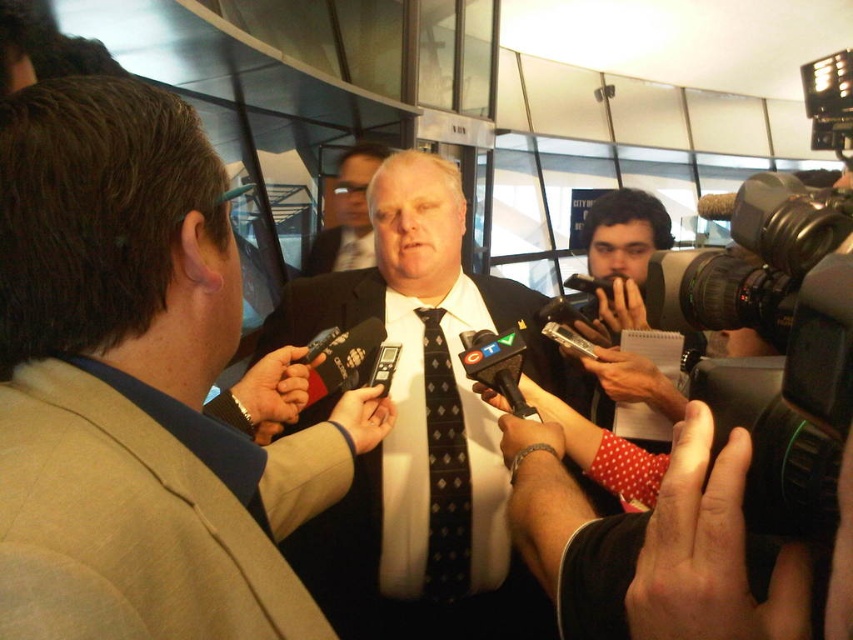
Does dark blue textured suit at center have a smaller size compared to matte black tie at center?

Yes.

Measure the distance from dark blue textured suit at center to matte black tie at center.

dark blue textured suit at center and matte black tie at center are 7.82 feet apart.

This screenshot has width=853, height=640. What are the coordinates of `dark blue textured suit at center` in the screenshot? It's located at (422, 472).

Between light brown suit at center and black dotted tie at center, which one is positioned higher?

light brown suit at center is above.

Does point (300, 512) lie in front of point (454, 538)?

That is True.

I want to click on light brown suit at center, so click(135, 387).

Does light brown suit at center appear over matte black tie at center?

No, light brown suit at center is not above matte black tie at center.

Does point (18, 536) come closer to viewer compared to point (364, 157)?

Yes, point (18, 536) is in front of point (364, 157).

You are a GUI agent. You are given a task and a screenshot of the screen. Output one action in this format:
    pyautogui.click(x=<x>, y=<y>)
    Task: Click on the light brown suit at center
    
    Given the screenshot: What is the action you would take?
    pyautogui.click(x=135, y=387)